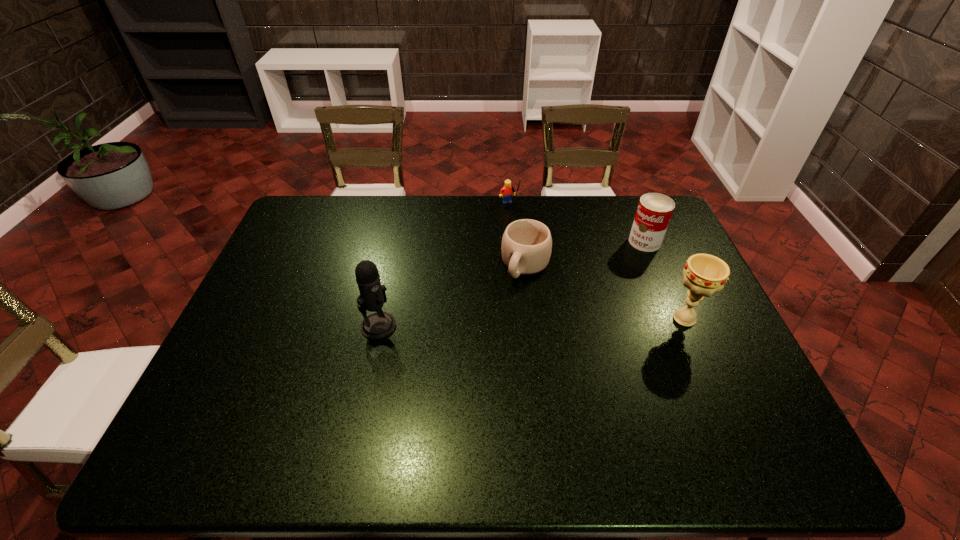
The image size is (960, 540). In order to click on vacant spot on the desktop that is between the tallest object and the chalice and is positioned on the front label of the can in this screenshot , I will do `click(502, 323)`.

Identify the location of free spot on the desktop that is between the tallest object and the chalice and is positioned on the side of the mug with the handle. (492, 323).

Where is `vacant space on the desktop that is between the tallest object and the second tallest object and is positioned on the front-facing side of the Lego`? vacant space on the desktop that is between the tallest object and the second tallest object and is positioned on the front-facing side of the Lego is located at coordinates (570, 321).